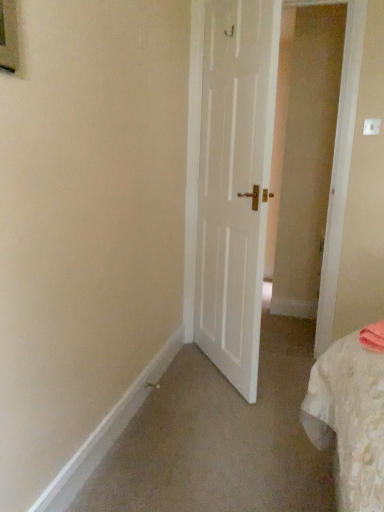
Question: Considering the relative sizes of white plastic electric outlet at upper right and white matte door at center in the image provided, is white plastic electric outlet at upper right bigger than white matte door at center?

Choices:
 (A) yes
 (B) no

Answer: (B)

Question: Can you confirm if white plastic electric outlet at upper right is taller than white matte door at center?

Choices:
 (A) yes
 (B) no

Answer: (B)

Question: Does white plastic electric outlet at upper right lie behind white matte door at center?

Choices:
 (A) no
 (B) yes

Answer: (B)

Question: Is white plastic electric outlet at upper right shorter than white matte door at center?

Choices:
 (A) no
 (B) yes

Answer: (B)

Question: Considering the relative sizes of white plastic electric outlet at upper right and white matte door at center in the image provided, is white plastic electric outlet at upper right thinner than white matte door at center?

Choices:
 (A) no
 (B) yes

Answer: (B)

Question: From the image's perspective, is white plastic electric outlet at upper right beneath white matte door at center?

Choices:
 (A) no
 (B) yes

Answer: (A)

Question: Is white matte door at center not within white plastic electric outlet at upper right?

Choices:
 (A) no
 (B) yes

Answer: (B)

Question: From a real-world perspective, is white matte door at center positioned under white plastic electric outlet at upper right based on gravity?

Choices:
 (A) no
 (B) yes

Answer: (B)

Question: Is white matte door at center bigger than white plastic electric outlet at upper right?

Choices:
 (A) yes
 (B) no

Answer: (A)

Question: Considering the relative sizes of white matte door at center and white plastic electric outlet at upper right in the image provided, is white matte door at center wider than white plastic electric outlet at upper right?

Choices:
 (A) no
 (B) yes

Answer: (B)

Question: Does white matte door at center lie behind white plastic electric outlet at upper right?

Choices:
 (A) no
 (B) yes

Answer: (A)

Question: Does white matte door at center have a smaller size compared to white plastic electric outlet at upper right?

Choices:
 (A) no
 (B) yes

Answer: (A)

Question: In terms of height, does white plastic electric outlet at upper right look taller or shorter compared to white matte door at center?

Choices:
 (A) short
 (B) tall

Answer: (A)